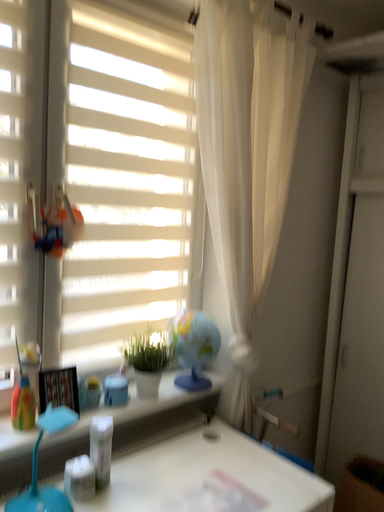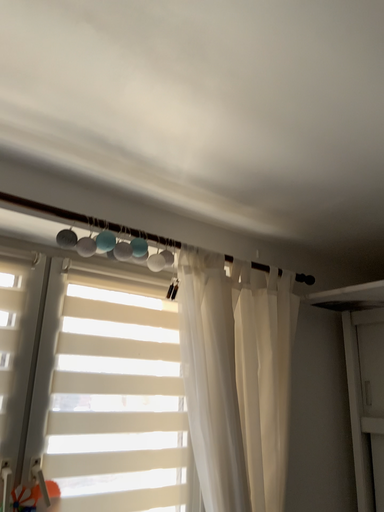
Question: Which way did the camera rotate in the video?

Choices:
 (A) rotated upward
 (B) rotated downward

Answer: (A)